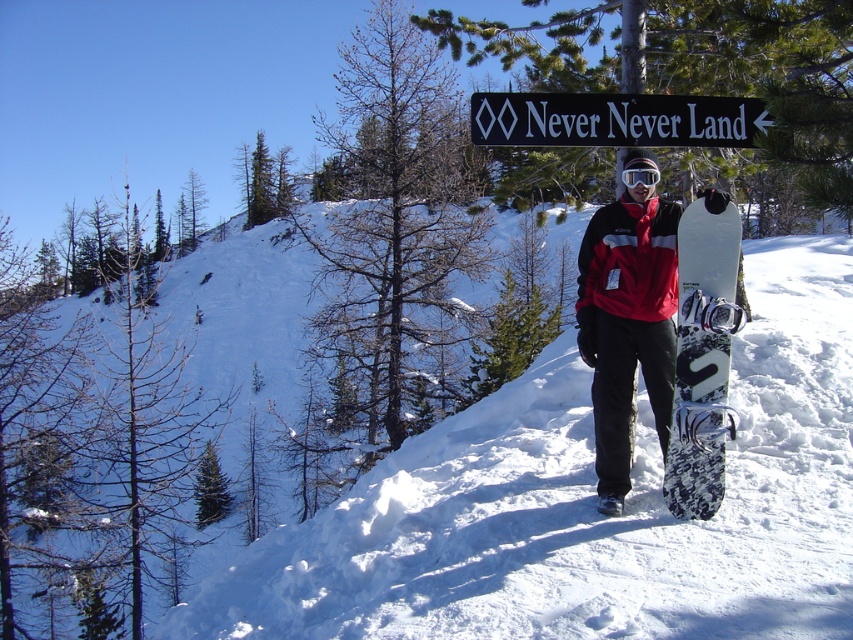
Between white camouflage snowboard at center and black plastic sign at upper center, which one is positioned higher?

Positioned higher is black plastic sign at upper center.

Does white camouflage snowboard at center have a smaller size compared to black plastic sign at upper center?

Yes.

Find the location of a particular element. white camouflage snowboard at center is located at coordinates (703, 355).

Does white fluffy snow at center have a smaller size compared to glossy plastic goggles at center?

Actually, white fluffy snow at center might be larger than glossy plastic goggles at center.

Who is more distant from viewer, (x=167, y=621) or (x=634, y=182)?

The point (x=167, y=621) is more distant.

The width and height of the screenshot is (853, 640). Identify the location of white fluffy snow at center. point(587,506).

Is point (614, 104) less distant than point (654, 166)?

That is False.

Does black plastic sign at upper center lie behind glossy plastic goggles at center?

Yes, it is behind glossy plastic goggles at center.

Does point (585, 122) come behind point (633, 173)?

That is True.

The height and width of the screenshot is (640, 853). I want to click on black plastic sign at upper center, so click(614, 120).